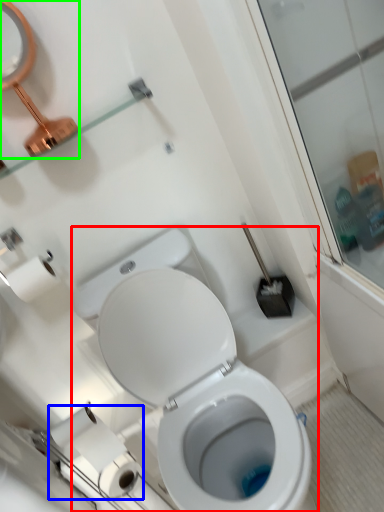
Question: Which is farther away from toilet (highlighted by a red box)? toilet paper (highlighted by a blue box) or mirror (highlighted by a green box)?

Choices:
 (A) toilet paper
 (B) mirror

Answer: (B)